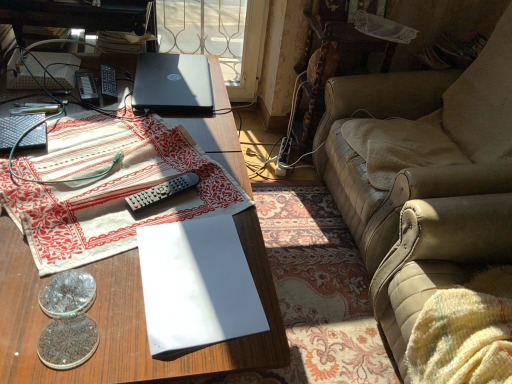
The width and height of the screenshot is (512, 384). Identify the location of empty space that is ontop of white paper at center, the second paperback book when ordered from back to front (from a real-world perspective). (200, 271).